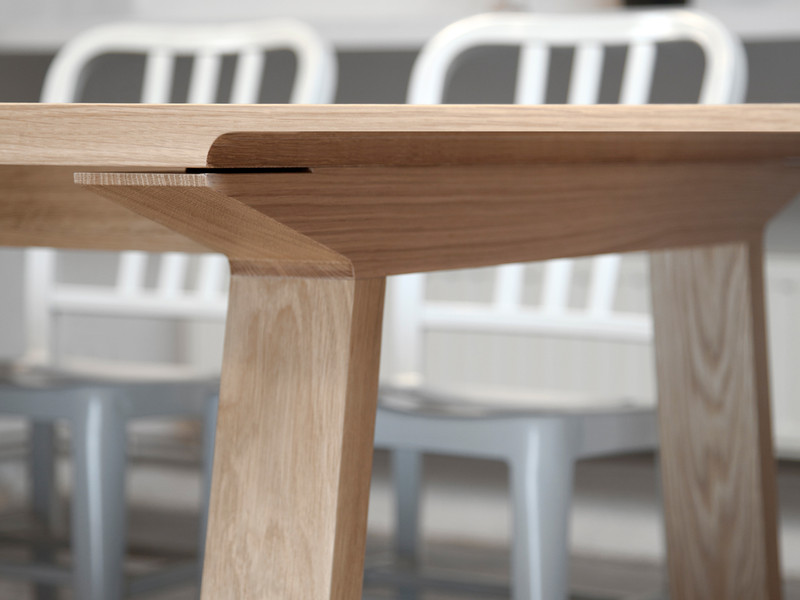
The width and height of the screenshot is (800, 600). What are the coordinates of `wood grain` in the screenshot? It's located at (296, 390), (710, 327), (508, 215), (470, 117), (64, 138), (54, 191).